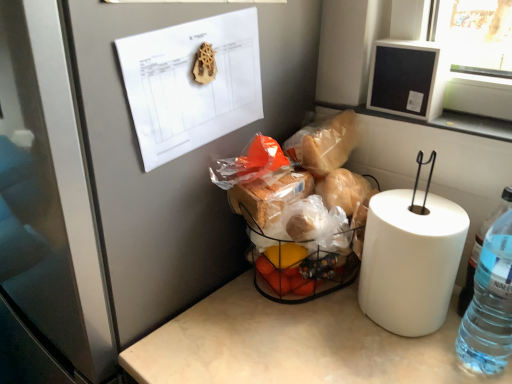
Question: Considering their positions, is white paper at upper left located in front of or behind black matte frame at upper right?

Choices:
 (A) behind
 (B) front

Answer: (B)

Question: From a real-world perspective, is white paper at upper left positioned above or below black matte frame at upper right?

Choices:
 (A) above
 (B) below

Answer: (A)

Question: Estimate the real-world distances between objects in this image. Which object is farther from the white glossy frame at upper right?

Choices:
 (A) black matte frame at upper right
 (B) clear plastic bottle at right
 (C) wooden gear at upper center
 (D) translucent plastic basket at center
 (E) white paper at upper left

Answer: (C)

Question: Based on their relative distances, which object is farther from the clear plastic bottle at right?

Choices:
 (A) white glossy frame at upper right
 (B) translucent plastic basket at center
 (C) wooden gear at upper center
 (D) white paper at upper left
 (E) black matte frame at upper right

Answer: (C)